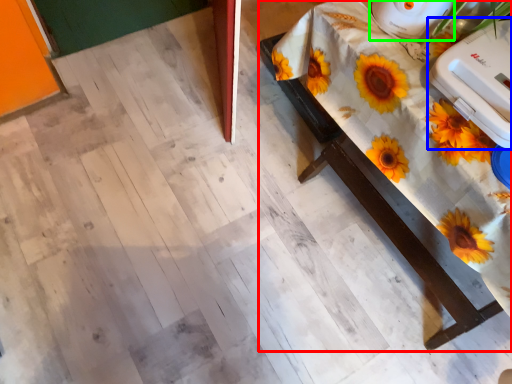
Question: Which object is the farthest from table (highlighted by a red box)? Choose among these: appliance (highlighted by a blue box) or appliance (highlighted by a green box).

Choices:
 (A) appliance
 (B) appliance

Answer: (B)